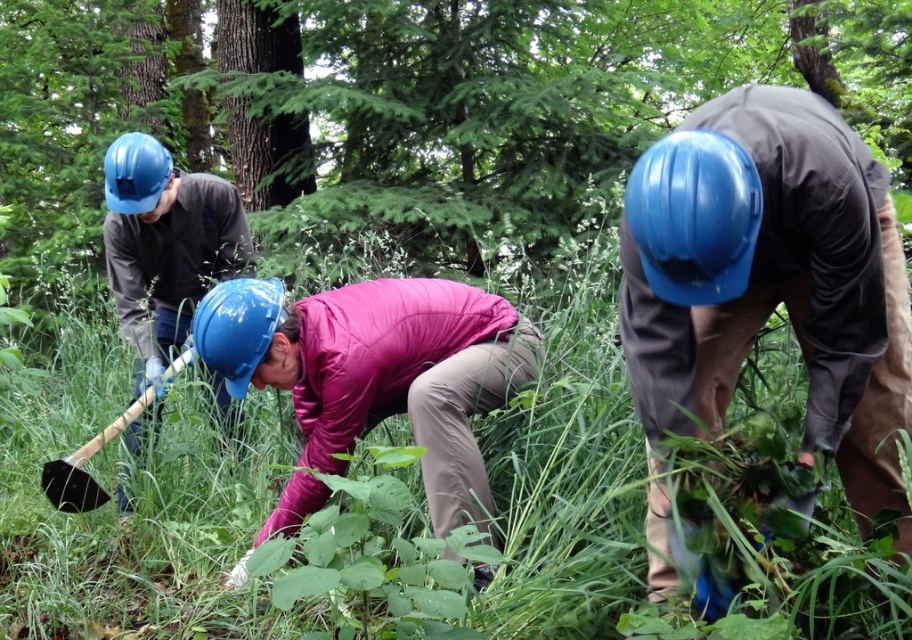
Question: Is pink fabric jacket at center above matte blue helmet at left?

Choices:
 (A) no
 (B) yes

Answer: (A)

Question: Is the position of green grass at center more distant than that of pink fabric jacket at center?

Choices:
 (A) no
 (B) yes

Answer: (B)

Question: Is pink fabric jacket at center thinner than black plastic shovel at lower left?

Choices:
 (A) yes
 (B) no

Answer: (B)

Question: Which of the following is the closest to the observer?

Choices:
 (A) blue hard hat at center
 (B) matte blue helmet at left
 (C) green grass at center
 (D) pink fabric jacket at center

Answer: (A)

Question: Considering the real-world distances, which object is closest to the green grass at center?

Choices:
 (A) black plastic shovel at lower left
 (B) pink fabric jacket at center
 (C) matte blue helmet at left

Answer: (A)

Question: Among these points, which one is nearest to the camera?

Choices:
 (A) (213, 385)
 (B) (441, 465)
 (C) (73, 509)
 (D) (670, 211)

Answer: (D)